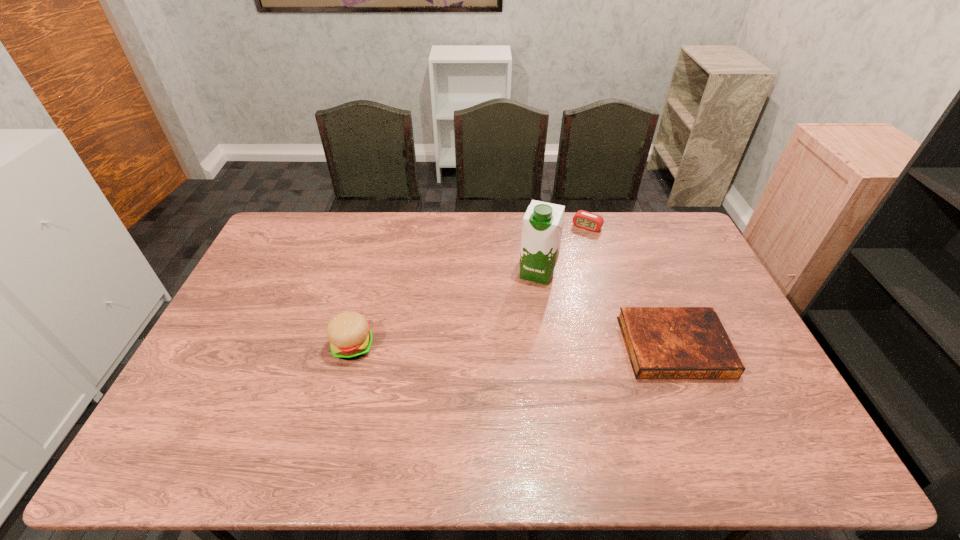
The width and height of the screenshot is (960, 540). I want to click on free space on the desktop that is between the hamburger and the shortest object and is positioned on the front-facing side of the alarm clock, so click(x=511, y=347).

Locate an element on the screen. free space on the desktop that is between the hamburger and the shortest object and is positioned on the front-facing side of the third object from right to left is located at coordinates pos(509,347).